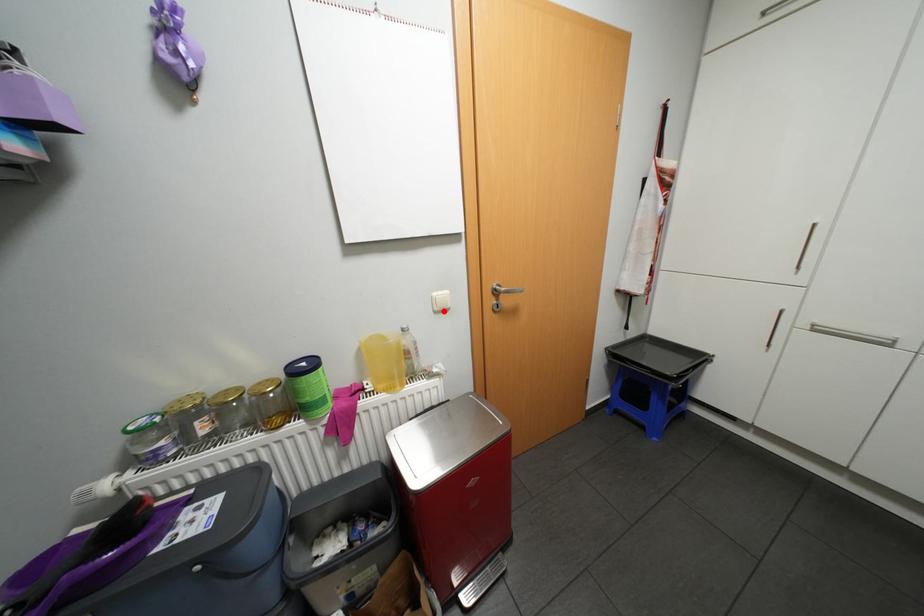
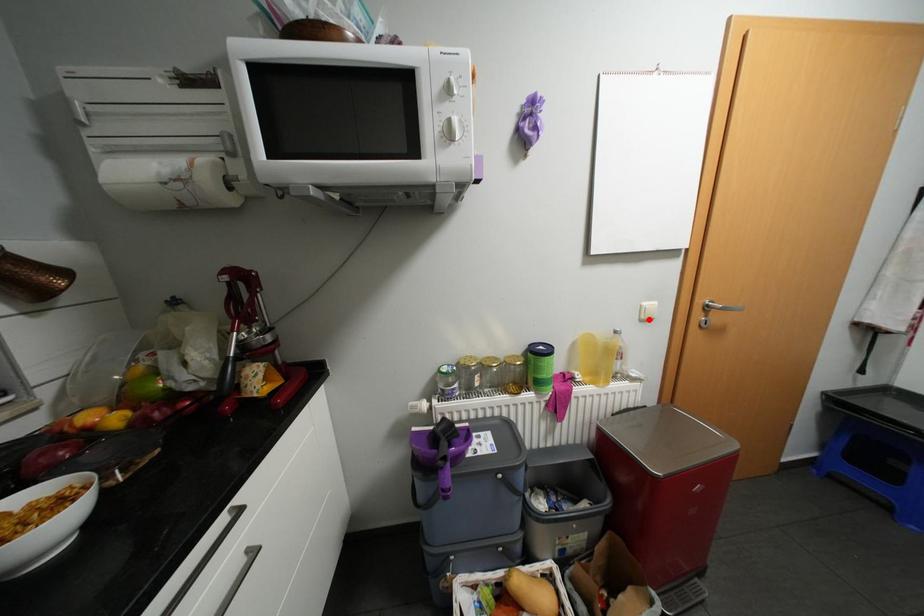
I am providing you with two images of the same scene from different viewpoints. A red point is marked on the first image and another point is marked on the second image. Are the points marked in image1 and image2 representing the same 3D position?

Yes